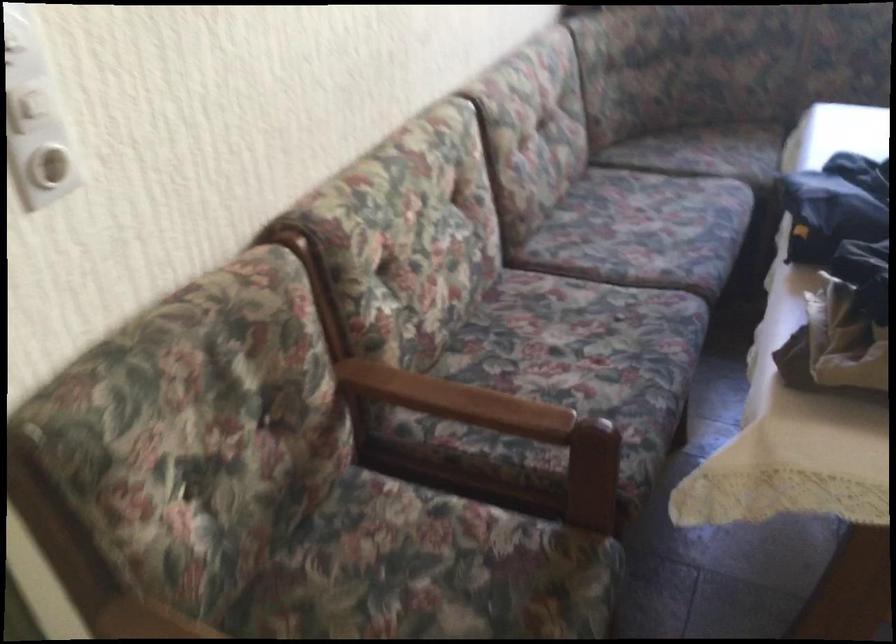
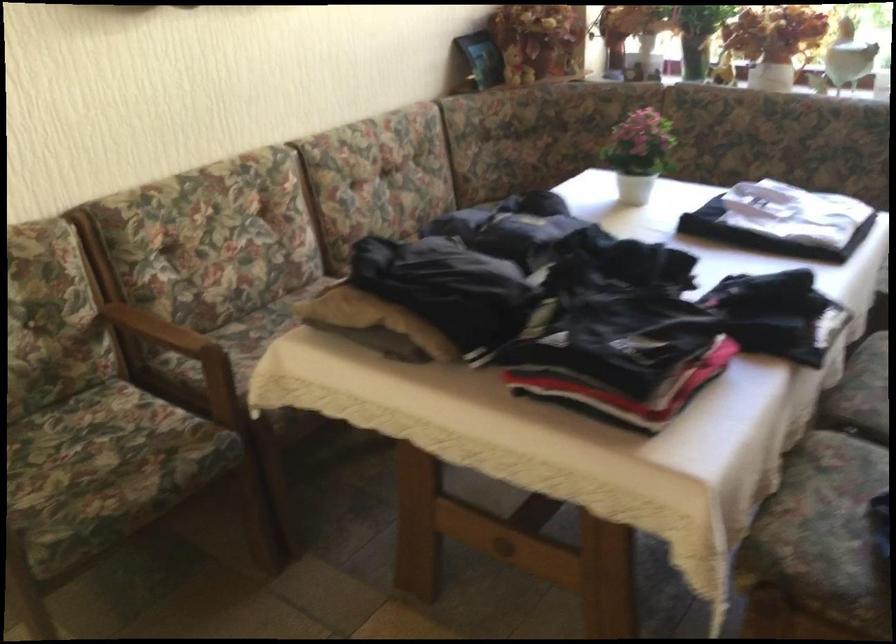
The point at (452, 397) is marked in the first image. Where is the corresponding point in the second image?

(158, 328)